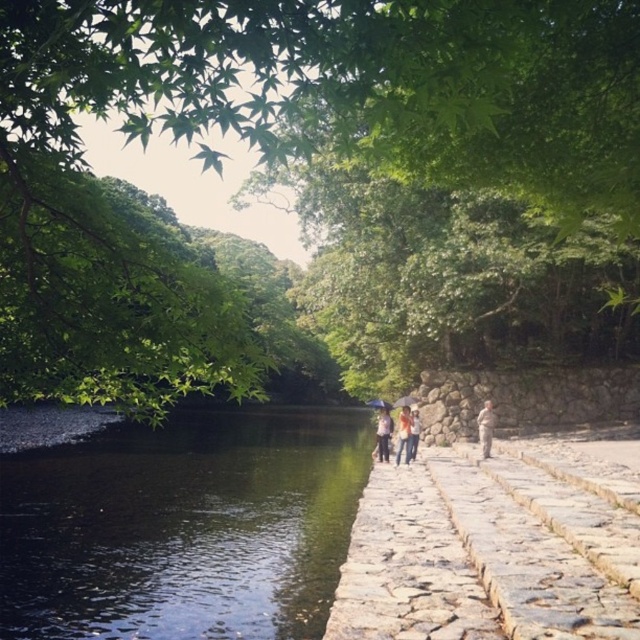
Question: Which point is farther to the camera?

Choices:
 (A) (237, 550)
 (B) (518, 525)
 (C) (403, 406)

Answer: (C)

Question: Which point appears farthest from the camera in this image?

Choices:
 (A) (573, 81)
 (B) (492, 406)
 (C) (410, 440)
 (D) (579, 456)

Answer: (B)

Question: Does green leafy tree at upper center have a larger size compared to light brown wooden umbrella at center?

Choices:
 (A) no
 (B) yes

Answer: (B)

Question: Is green leafy tree at upper center below light brown fabric jacket at center?

Choices:
 (A) yes
 (B) no

Answer: (B)

Question: Is light brown wooden umbrella at center smaller than light brown fabric jacket at center?

Choices:
 (A) no
 (B) yes

Answer: (B)

Question: Which point is farther from the camera taking this photo?

Choices:
 (A) (481, 408)
 (B) (220, 472)

Answer: (A)